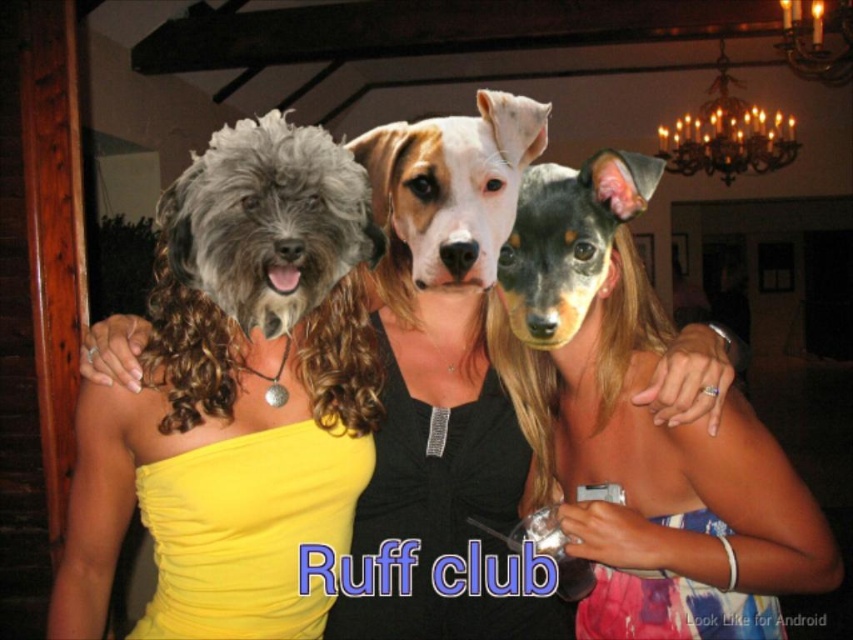
Can you confirm if matte black dress at center is smaller than fuzzy gray dog at left?

No, matte black dress at center is not smaller than fuzzy gray dog at left.

The height and width of the screenshot is (640, 853). I want to click on matte black dress at center, so click(x=639, y=429).

Where is `matte black dress at center`? The width and height of the screenshot is (853, 640). matte black dress at center is located at coordinates (639, 429).

Is white fur dog at center taller than yellow satin dress at center?

Incorrect, white fur dog at center's height is not larger of yellow satin dress at center's.

Which is below, white fur dog at center or yellow satin dress at center?

yellow satin dress at center is below.

Does point (401, 179) come in front of point (459, 445)?

Yes, it is.

Find the location of a particular element. Image resolution: width=853 pixels, height=640 pixels. white fur dog at center is located at coordinates (453, 184).

In the scene shown: Which of these two, fuzzy gray dog at left or yellow satin dress at center, stands taller?

yellow satin dress at center

Is fuzzy gray dog at left to the right of yellow satin dress at center from the viewer's perspective?

Incorrect, fuzzy gray dog at left is not on the right side of yellow satin dress at center.

Image resolution: width=853 pixels, height=640 pixels. I want to click on fuzzy gray dog at left, so click(267, 221).